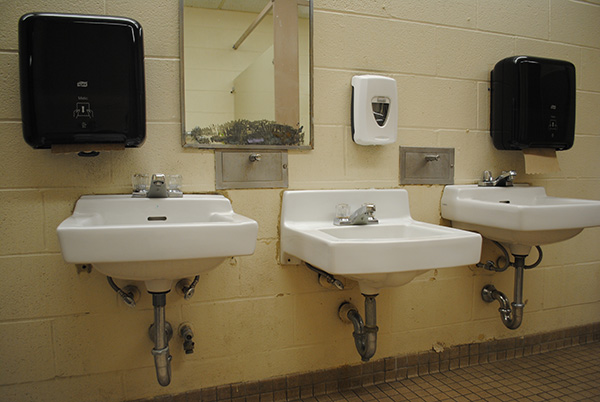
Find the location of a particular element. This screenshot has height=402, width=600. brown floor with black horizontal and vertical lines is located at coordinates (504, 379), (571, 380), (424, 390).